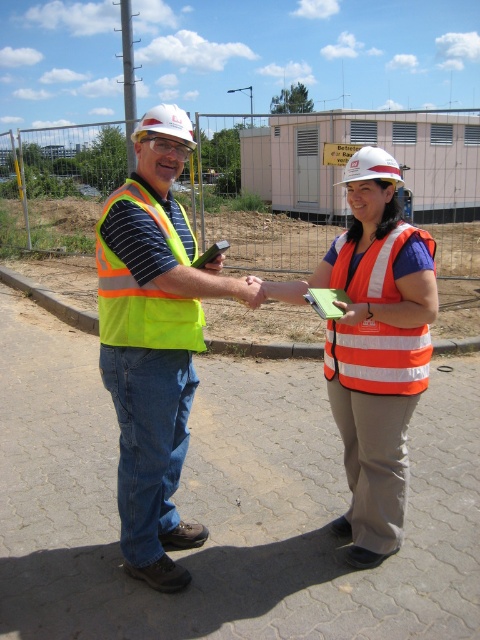
Question: Among these points, which one is nearest to the camera?

Choices:
 (A) (384, 346)
 (B) (97, 262)

Answer: (A)

Question: Can you confirm if neon yellow vest at center is positioned above orange reflective vest at center?

Choices:
 (A) no
 (B) yes

Answer: (B)

Question: Can you confirm if neon yellow vest at center is positioned below high-visibility fabric safety vest at center?

Choices:
 (A) no
 (B) yes

Answer: (A)

Question: Is neon yellow vest at center thinner than high-visibility fabric safety vest at center?

Choices:
 (A) no
 (B) yes

Answer: (A)

Question: Among these points, which one is nearest to the camera?

Choices:
 (A) (160, 486)
 (B) (408, 460)
 (C) (406, 340)
 (D) (159, 230)

Answer: (D)

Question: Which object appears closest to the camera in this image?

Choices:
 (A) orange reflective safety vest at center
 (B) high-visibility fabric safety vest at center
 (C) orange reflective vest at center

Answer: (B)